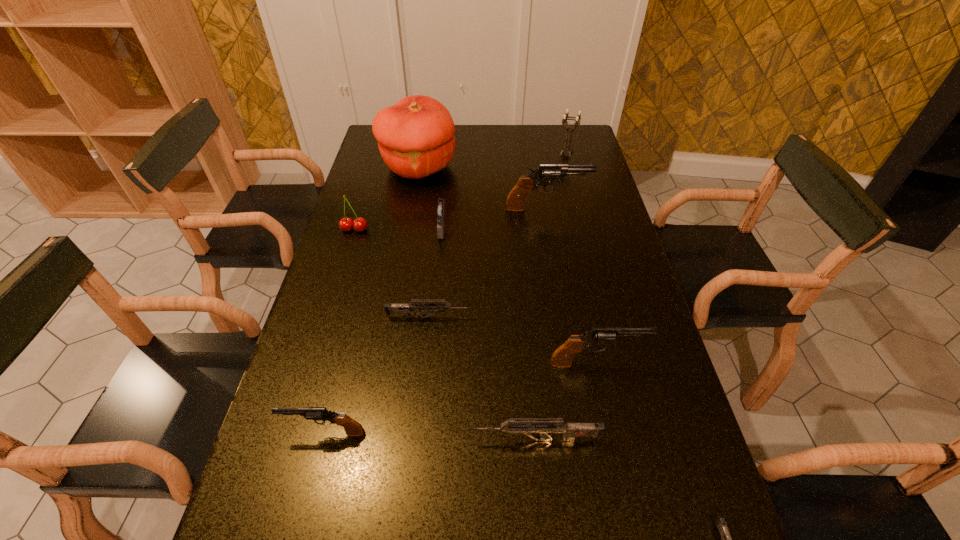
Where is `the second grey gun from left to right`? the second grey gun from left to right is located at coordinates (545, 427).

The image size is (960, 540). I want to click on the third shortest gun, so click(545, 427).

Locate an element on the screen. The width and height of the screenshot is (960, 540). the second smallest grey gun is located at coordinates (405, 309).

The image size is (960, 540). Identify the location of the sixth farthest object. (405, 309).

Locate an element on the screen. blank area located 0.230m on the right of the tallest object is located at coordinates (520, 167).

Image resolution: width=960 pixels, height=540 pixels. I want to click on vacant space located along the barrel of the biggest black gun, so click(x=603, y=208).

Image resolution: width=960 pixels, height=540 pixels. Identify the location of vacant space located on the left of the candle holder. (496, 153).

What are the coordinates of `free location located on the left of the igniter` in the screenshot? It's located at (358, 228).

Image resolution: width=960 pixels, height=540 pixels. Identify the location of vacant space located with the stems of the cherry pointing upwards. (338, 285).

Where is `vacant position located aimed along the barrel of the third shortest gun`? This screenshot has height=540, width=960. vacant position located aimed along the barrel of the third shortest gun is located at coordinates (376, 440).